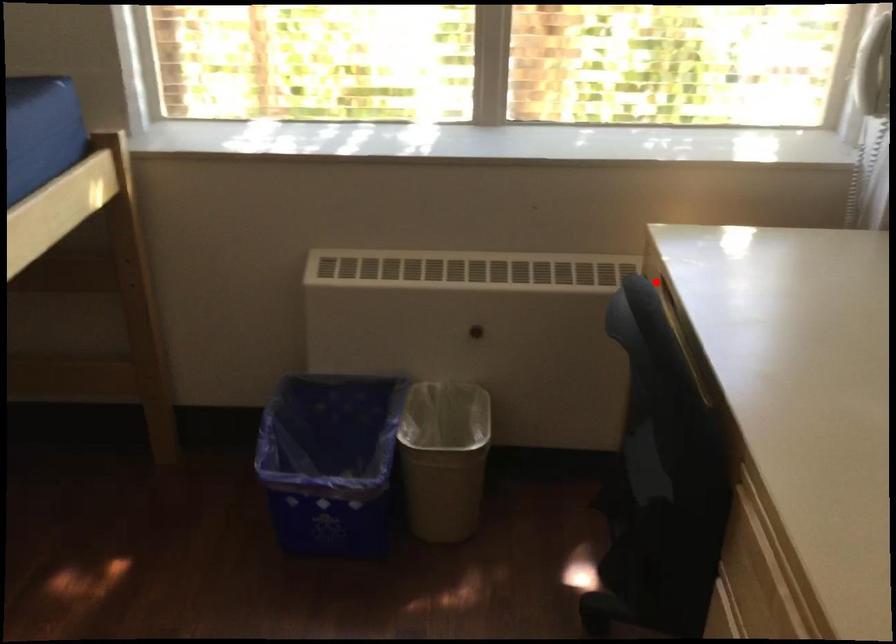
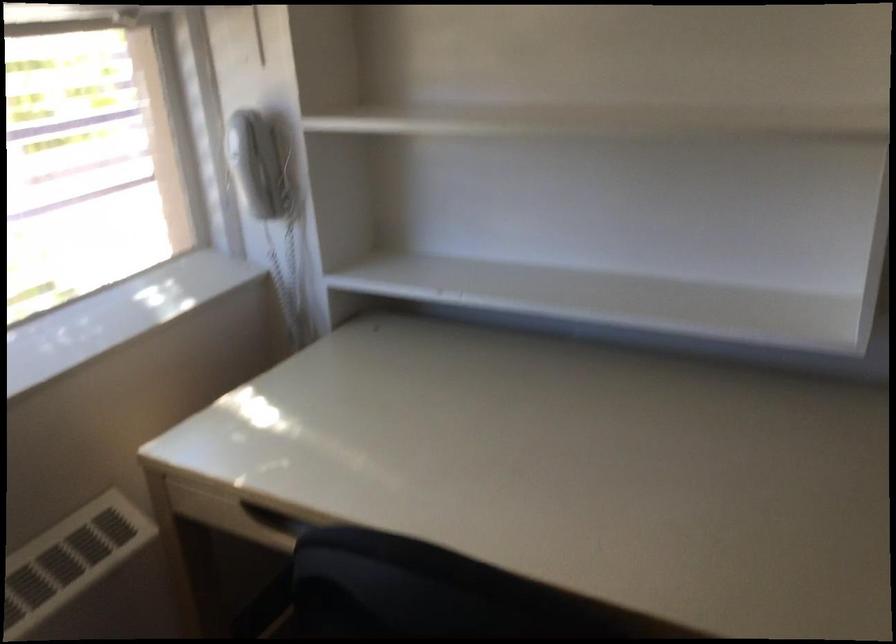
Locate, in the second image, the point that corresponds to the highlighted location in the first image.

(239, 516)